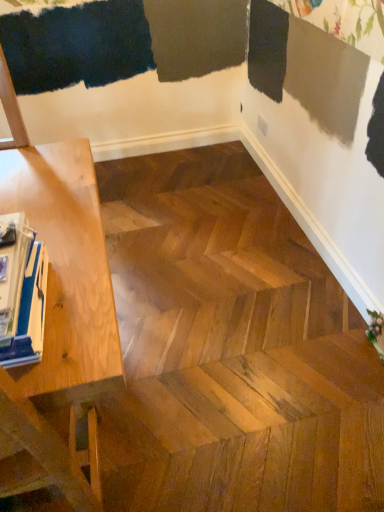
Question: Are light wood table at left and blue glossy magazine at left located far from each other?

Choices:
 (A) no
 (B) yes

Answer: (A)

Question: Can you see light wood table at left touching blue glossy magazine at left?

Choices:
 (A) yes
 (B) no

Answer: (B)

Question: Is light wood table at left oriented towards blue glossy magazine at left?

Choices:
 (A) yes
 (B) no

Answer: (B)

Question: Is light wood table at left smaller than blue glossy magazine at left?

Choices:
 (A) yes
 (B) no

Answer: (B)

Question: Can you confirm if light wood table at left is taller than blue glossy magazine at left?

Choices:
 (A) no
 (B) yes

Answer: (B)

Question: Does light wood table at left have a greater width compared to blue glossy magazine at left?

Choices:
 (A) yes
 (B) no

Answer: (A)

Question: Is blue glossy magazine at left not inside light wood table at left?

Choices:
 (A) no
 (B) yes

Answer: (A)

Question: Is blue glossy magazine at left facing away from light wood table at left?

Choices:
 (A) yes
 (B) no

Answer: (A)

Question: Considering the relative positions of blue glossy magazine at left and light wood table at left in the image provided, is blue glossy magazine at left in front of light wood table at left?

Choices:
 (A) yes
 (B) no

Answer: (B)

Question: Is blue glossy magazine at left thinner than light wood table at left?

Choices:
 (A) yes
 (B) no

Answer: (A)

Question: Would you say blue glossy magazine at left is a long distance from light wood table at left?

Choices:
 (A) no
 (B) yes

Answer: (A)

Question: Considering the relative sizes of blue glossy magazine at left and light wood table at left in the image provided, is blue glossy magazine at left shorter than light wood table at left?

Choices:
 (A) no
 (B) yes

Answer: (B)

Question: In terms of width, does light wood table at left look wider or thinner when compared to blue glossy magazine at left?

Choices:
 (A) thin
 (B) wide

Answer: (B)